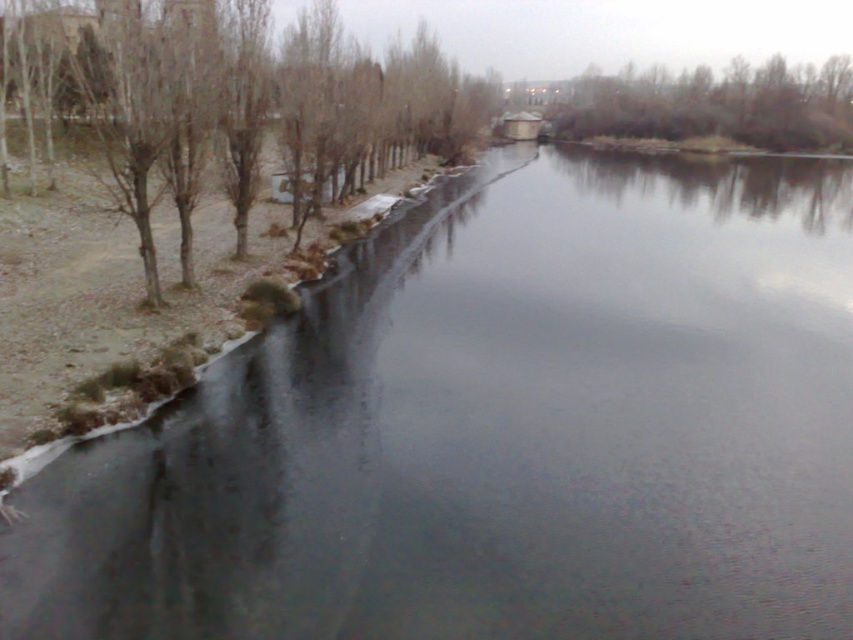
Is point (209, 8) farther from camera compared to point (851, 115)?

No, it is not.

Who is lower down, bare branches at left or brown textured tree at upper right?

bare branches at left is lower down.

Describe the element at coordinates (233, 100) in the screenshot. This screenshot has height=640, width=853. I see `bare branches at left` at that location.

You are a GUI agent. You are given a task and a screenshot of the screen. Output one action in this format:
    pyautogui.click(x=<x>, y=<y>)
    Task: Click on the bare branches at left
    
    Given the screenshot: What is the action you would take?
    pyautogui.click(x=233, y=100)